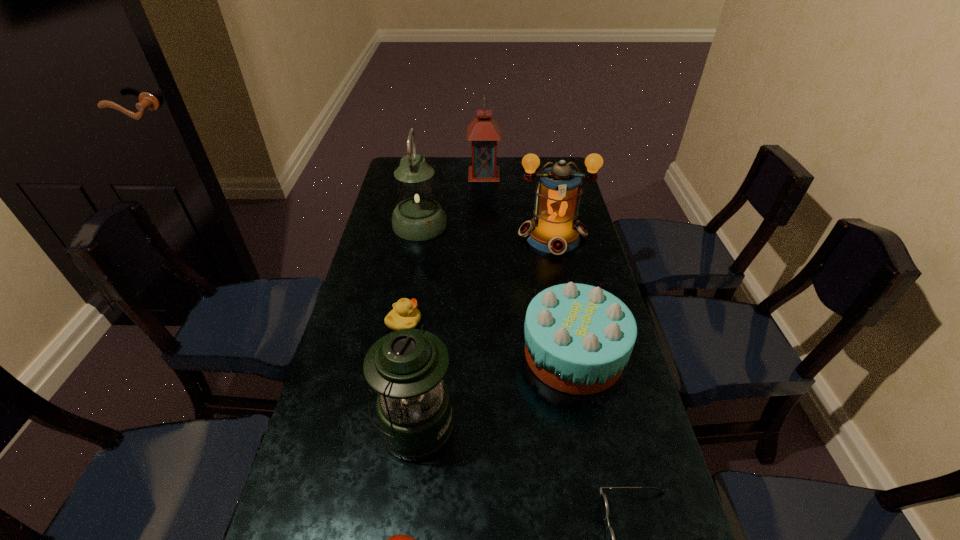
At what (x,y) coordinates should I click in order to perform the action: click on vacant region located on the beak of the duckling. Please return your answer as a coordinate pair (x, y). The width and height of the screenshot is (960, 540). Looking at the image, I should click on (468, 322).

The image size is (960, 540). Find the location of `object that is positioned at the far edge`. object that is positioned at the far edge is located at coordinates (484, 132).

I want to click on duckling present at the left edge, so point(405,315).

In order to click on lantern located in the right edge section of the desktop in this screenshot , I will do `click(554, 229)`.

Where is `cake positioned at the right edge`? The image size is (960, 540). cake positioned at the right edge is located at coordinates (578, 338).

In the image, there is a desktop. Where is `free space at the far edge`? free space at the far edge is located at coordinates (503, 181).

At what (x,y) coordinates should I click in order to perform the action: click on free region at the left edge of the desktop. Please return your answer as a coordinate pair (x, y). The width and height of the screenshot is (960, 540). Looking at the image, I should click on (382, 212).

This screenshot has height=540, width=960. In the image, there is a desktop. In order to click on vacant region at the right edge in this screenshot , I will do `click(581, 418)`.

Find the location of `free spot between the fifth object from left to right and the duckling`. free spot between the fifth object from left to right and the duckling is located at coordinates point(444,248).

The height and width of the screenshot is (540, 960). I want to click on empty space between the nearest lantern and the farthest object, so click(449, 300).